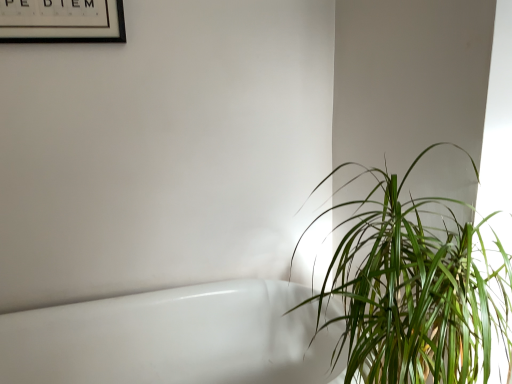
Question: Considering the positions of point (31, 329) and point (112, 24), is point (31, 329) closer or farther from the camera than point (112, 24)?

Choices:
 (A) farther
 (B) closer

Answer: (A)

Question: Visually, is white glossy bathtub at lower left positioned to the left or to the right of black matte picture frame at upper left?

Choices:
 (A) right
 (B) left

Answer: (A)

Question: Estimate the real-world distances between objects in this image. Which object is farther from the white glossy bathtub at lower left?

Choices:
 (A) green leafy plant at right
 (B) black matte picture frame at upper left

Answer: (B)

Question: Estimate the real-world distances between objects in this image. Which object is closer to the white glossy bathtub at lower left?

Choices:
 (A) green leafy plant at right
 (B) black matte picture frame at upper left

Answer: (A)